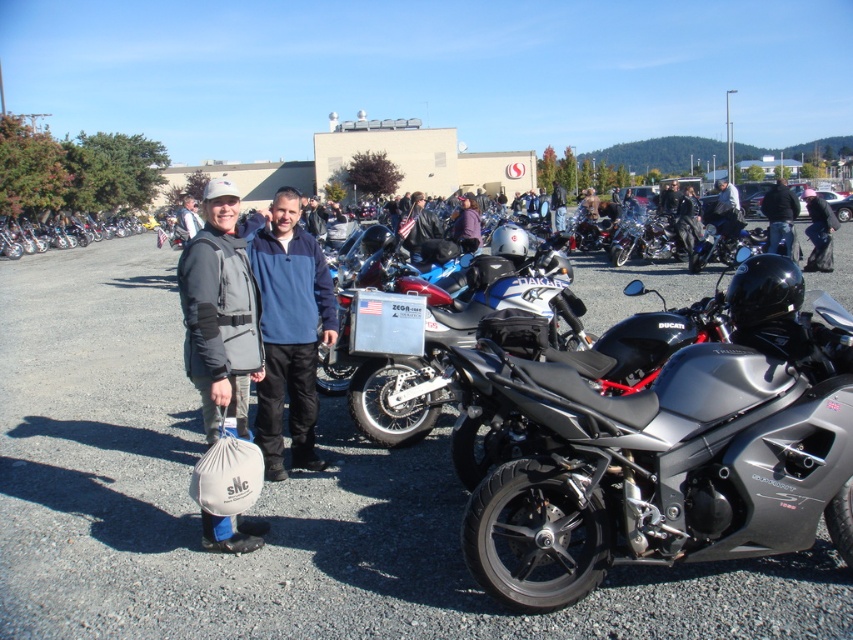
You are a photographer at the motorcycle event and want to take a photo that includes both the point at [819,458] and the point at [721,198]. Which point should you focus on first to ensure both are in sharp focus?

You should focus on the point closer to the viewer, which is point [819,458], to ensure both points are in sharp focus since it is nearer and the depth of field will extend backward to the farther point [721,198].

You are a photographer setting up a tripod to capture the metallic silver motorcycle at center and the dark gray leather jacket at center. Which object should you position closer to the camera to ensure both fit in the frame?

The metallic silver motorcycle at center has a lesser width compared to dark gray leather jacket at center, so you should position the metallic silver motorcycle at center closer to the camera to ensure both fit in the frame.

You are a photographer at the motorcycle event. You want to take a photo of the metallic silver motorcycle at center and the dark gray leather jacket at center. Can you frame both in the same shot without moving either object? Explain why or why not based on their positions.

The metallic silver motorcycle at center is below the dark gray leather jacket at center, so they are vertically aligned. This means the jacket is positioned higher up, likely on a person, while the motorcycle is lower. Since they are in the same central area but at different vertical levels, you can frame both in the same shot by adjusting the camera angle to include both the lower motorcycle and the higher jacket without needing to move either object.